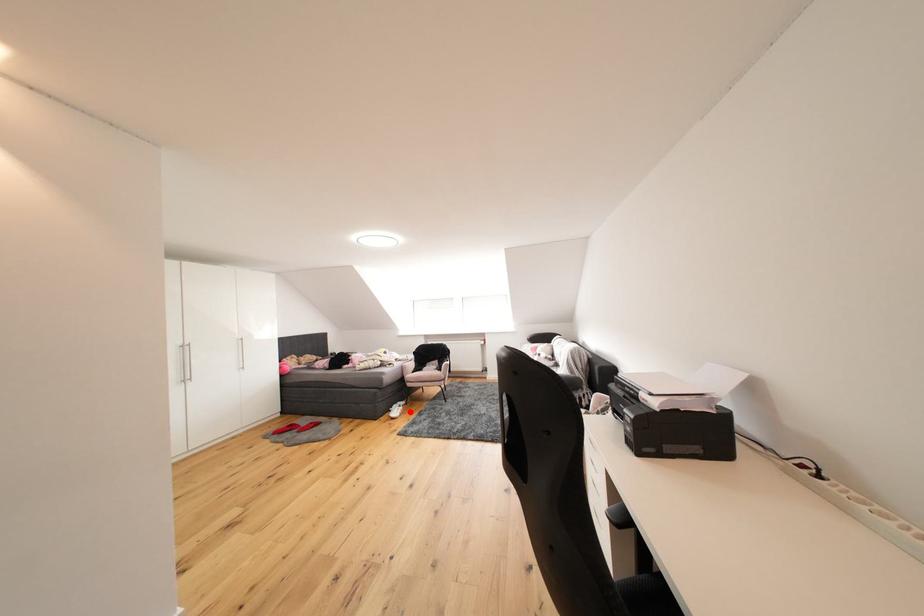
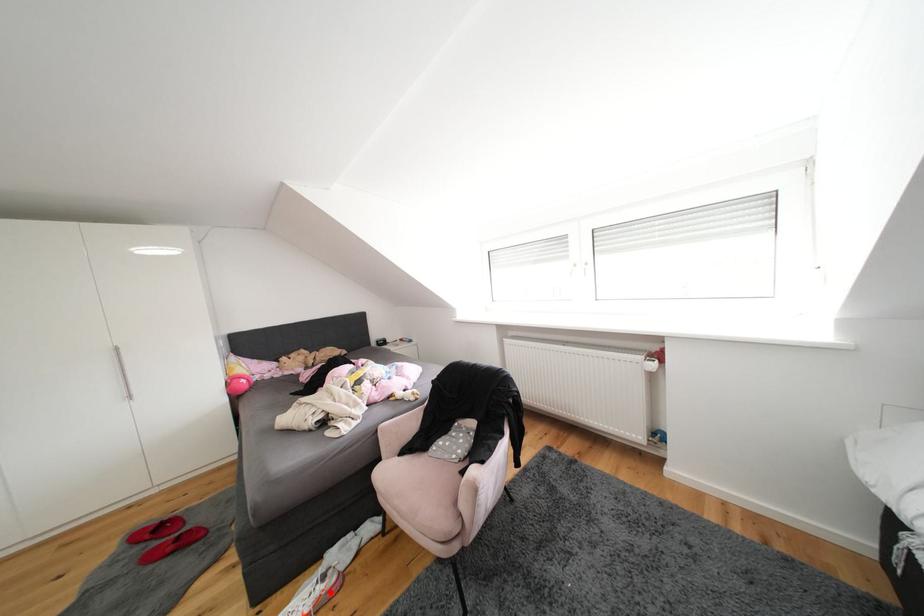
I am providing you with two images of the same scene from different viewpoints. A red point is marked on the first image and another point is marked on the second image. Do the highlighted points in image1 and image2 indicate the same real-world spot?

Yes